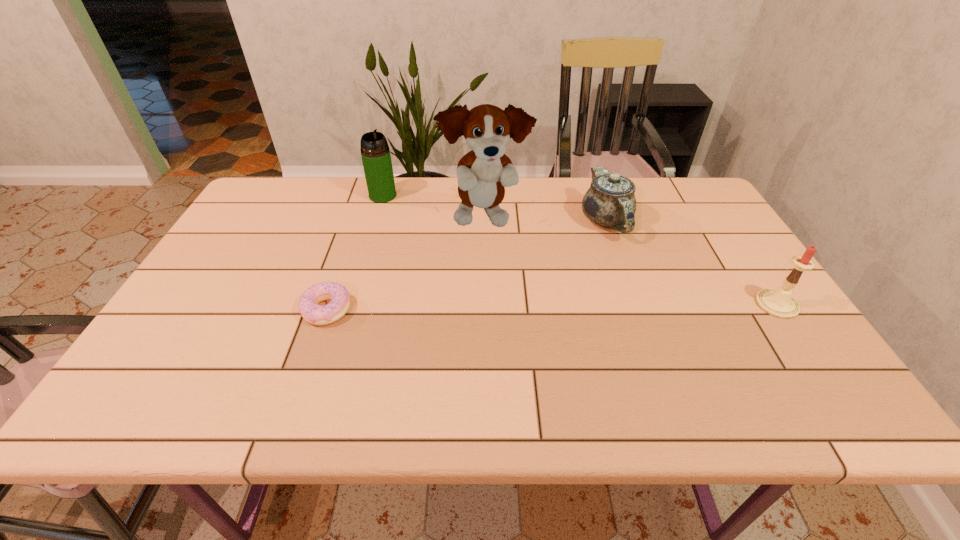
Identify the location of empty space between the fourth shortest object and the tallest object. The image size is (960, 540). (434, 207).

Locate an element on the screen. This screenshot has width=960, height=540. free area in between the fourth object from left to right and the puppy is located at coordinates (545, 220).

Identify the location of free space between the shortest object and the fourth tallest object. The width and height of the screenshot is (960, 540). (467, 265).

At what (x,y) coordinates should I click in order to perform the action: click on free point between the third object from right to left and the rightmost object. Please return your answer as a coordinate pair (x, y). The image size is (960, 540). Looking at the image, I should click on (x=631, y=261).

Identify the location of free space between the doughnut and the rightmost object. (552, 307).

Locate an element on the screen. empty location between the candle and the thermos bottle is located at coordinates (580, 250).

What are the coordinates of `unoccupied area between the doughnut and the fourth shortest object` in the screenshot? It's located at (354, 253).

At what (x,y) coordinates should I click in order to perform the action: click on blank region between the fourth shortest object and the doughnut. Please return your answer as a coordinate pair (x, y). Looking at the image, I should click on point(354,253).

In order to click on vacant space in between the shortest object and the second object from right to left in this screenshot , I will do `click(467, 265)`.

The width and height of the screenshot is (960, 540). Find the location of `object that is the second nearest to the third object from right to left`. object that is the second nearest to the third object from right to left is located at coordinates (610, 202).